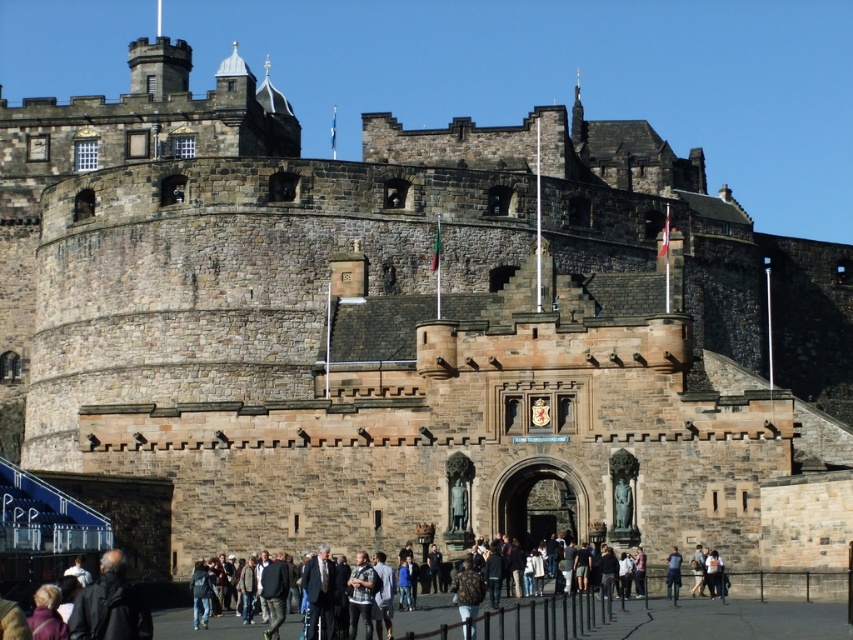
In the scene shown: You are a tour guide preparing to lead a group through Edinburgh Castle. You notice a dark brown leather jacket at lower left and dark blue jeans at lower center. Which item is wider?

The dark brown leather jacket at lower left is wider than the dark blue jeans at lower center.

In the scene shown: You are standing at the entrance of Edinburgh Castle and notice a dark brown leather jacket at lower left. If you want to pick it up, which direction should you move relative to the entrance?

The dark brown leather jacket at lower left is located at point (109,605), so you should move to the lower left direction from the entrance to pick it up.